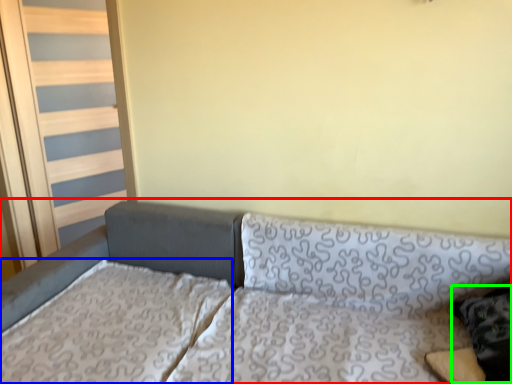
Question: Which object is positioned closest to studio couch (highlighted by a red box)? Select from mattress (highlighted by a blue box) and pillow (highlighted by a green box).

Choices:
 (A) mattress
 (B) pillow

Answer: (A)